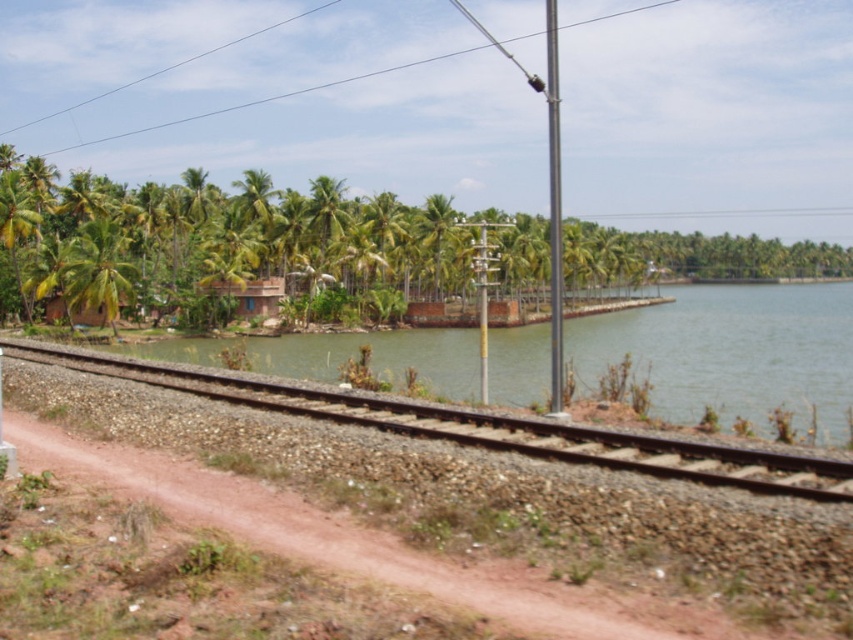
Question: Which is farther from the green leafy palm tree at center?

Choices:
 (A) green leafy palm tree at left
 (B) metallic pole at center
 (C) brown gravel track at lower center

Answer: (C)

Question: Does brown gravel track at lower center have a smaller size compared to brown clay hut at center?

Choices:
 (A) yes
 (B) no

Answer: (B)

Question: Can you confirm if green leafy palm tree at left is positioned below metallic pole at center?

Choices:
 (A) yes
 (B) no

Answer: (B)

Question: Estimate the real-world distances between objects in this image. Which object is closer to the brown gravel track at lower center?

Choices:
 (A) metallic pole at center
 (B) green leafy palm tree at left

Answer: (A)

Question: Which point is farther to the camera?

Choices:
 (A) green leafy palm tree at left
 (B) metallic pole at center

Answer: (A)

Question: Does brown gravel track at lower center lie behind metallic pole at center?

Choices:
 (A) yes
 (B) no

Answer: (B)